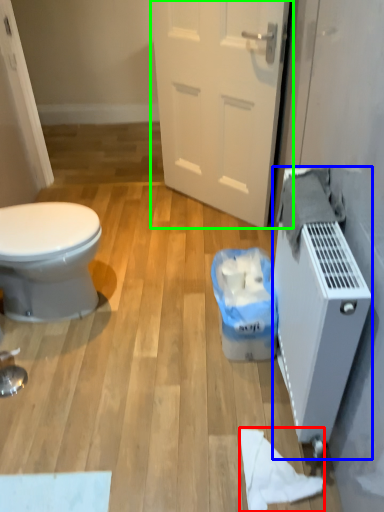
Question: Considering the real-world distances, which object is closest to toilet paper (highlighted by a red box)? water heater (highlighted by a blue box) or door (highlighted by a green box).

Choices:
 (A) water heater
 (B) door

Answer: (A)